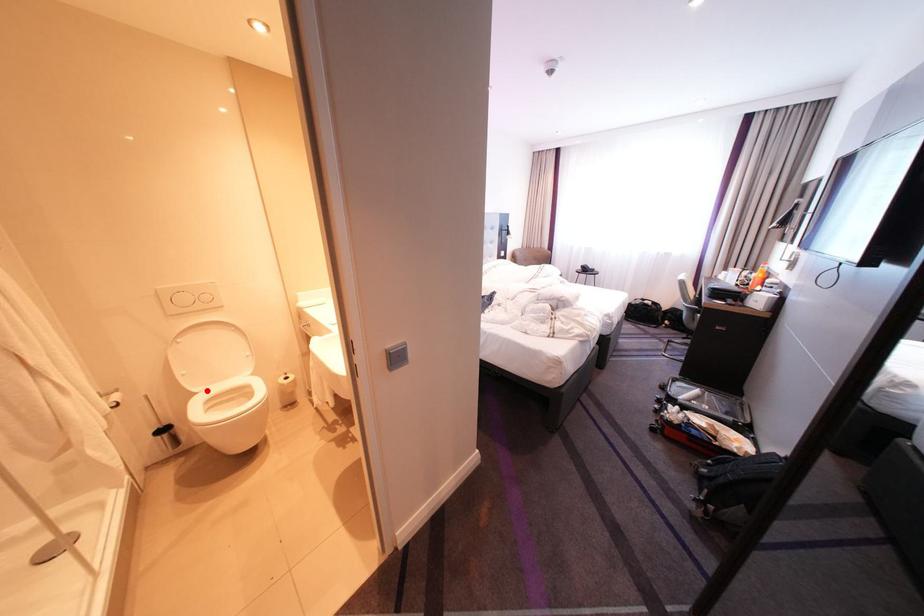
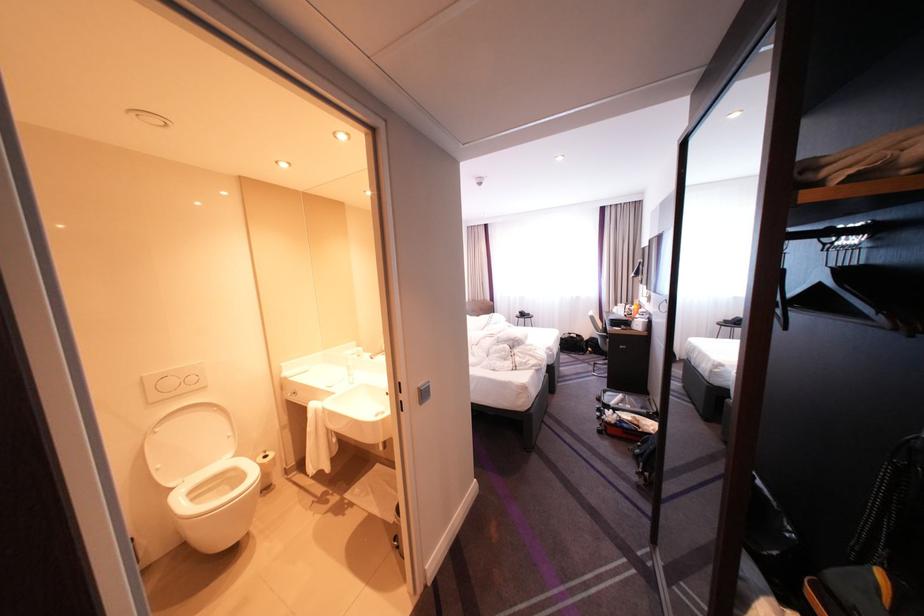
Where in the second image is the point corresponding to the highlighted location from the first image?

(183, 485)